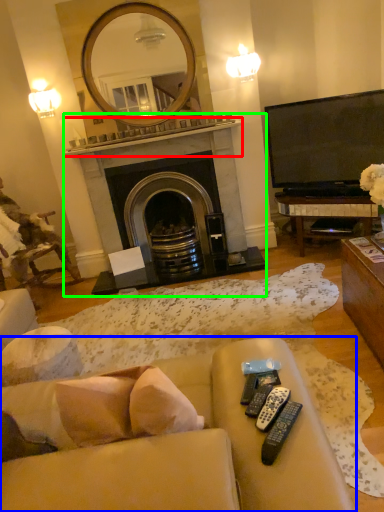
Question: Based on their relative distances, which object is farther from mantle (highlighted by a red box)? Choose from studio couch (highlighted by a blue box) and fireplace (highlighted by a green box).

Choices:
 (A) studio couch
 (B) fireplace

Answer: (A)